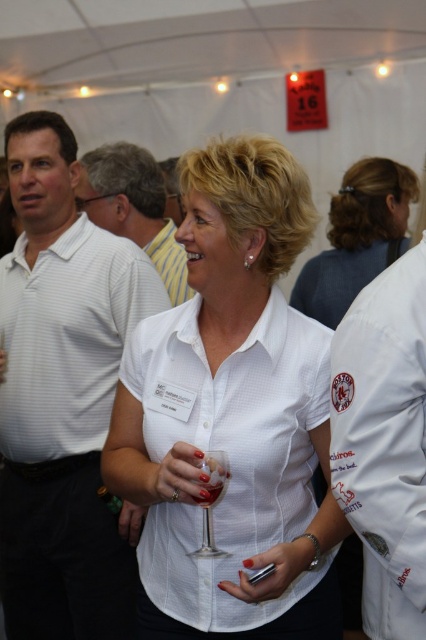
The width and height of the screenshot is (426, 640). What do you see at coordinates (68, 339) in the screenshot?
I see `white striped polo shirt at left` at bounding box center [68, 339].

Identify the location of white striped polo shirt at left. The image size is (426, 640). [68, 339].

Is white striped shirt at left to the left of white striped shirt at upper left from the viewer's perspective?

Indeed, white striped shirt at left is positioned on the left side of white striped shirt at upper left.

Does white striped shirt at left come in front of white striped shirt at upper left?

Yes, it is in front of white striped shirt at upper left.

What do you see at coordinates (62, 396) in the screenshot? Image resolution: width=426 pixels, height=640 pixels. I see `white striped shirt at left` at bounding box center [62, 396].

Where is `white striped shirt at left`? white striped shirt at left is located at coordinates (62, 396).

Consider the image. Does white striped polo shirt at left have a lesser height compared to clear glass at center?

In fact, white striped polo shirt at left may be taller than clear glass at center.

Image resolution: width=426 pixels, height=640 pixels. Find the location of `white striped polo shirt at left`. white striped polo shirt at left is located at coordinates (68, 339).

This screenshot has height=640, width=426. Identify the location of white striped polo shirt at left. (68, 339).